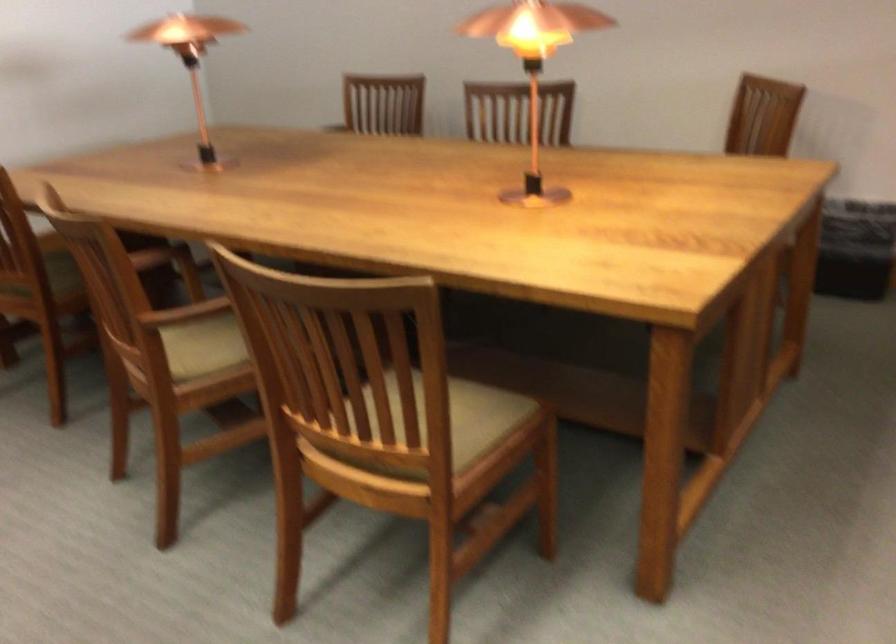
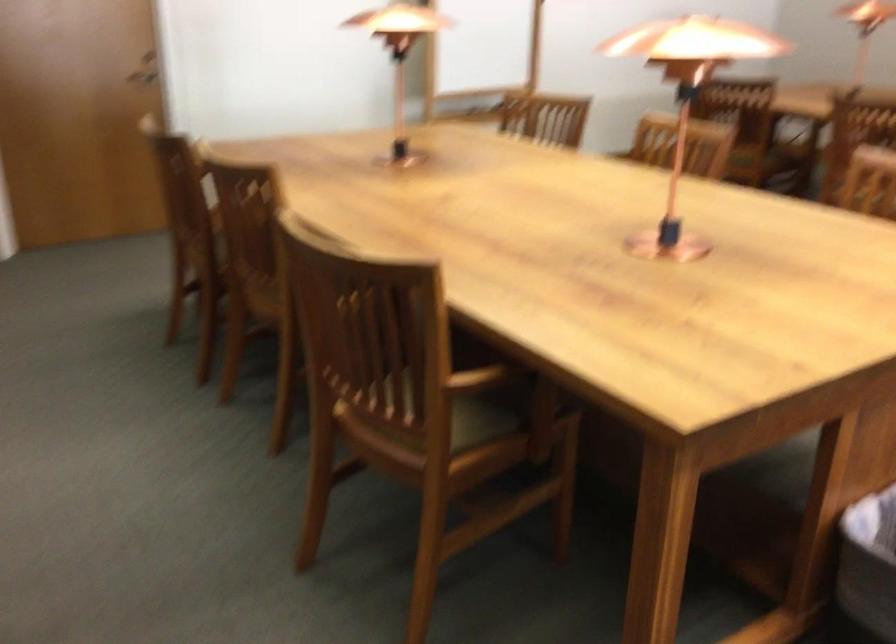
Which direction would the cameraman need to move to produce the second image?

The cameraman moved toward left, backward.